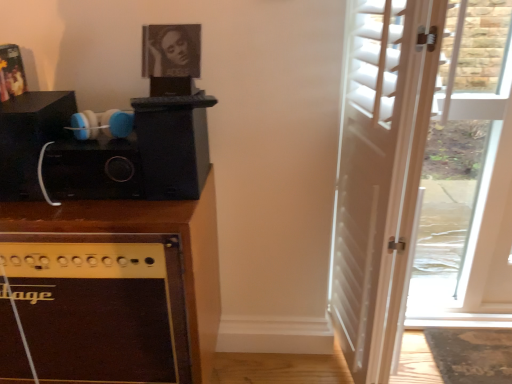
Question: Is matte black picture frame at upper center placed right next to brown wood cabinet at left?

Choices:
 (A) no
 (B) yes

Answer: (A)

Question: From the image's perspective, is matte black picture frame at upper center above brown wood cabinet at left?

Choices:
 (A) yes
 (B) no

Answer: (A)

Question: Is matte black picture frame at upper center oriented towards brown wood cabinet at left?

Choices:
 (A) no
 (B) yes

Answer: (A)

Question: Does matte black picture frame at upper center have a smaller size compared to brown wood cabinet at left?

Choices:
 (A) no
 (B) yes

Answer: (B)

Question: Is matte black picture frame at upper center not inside brown wood cabinet at left?

Choices:
 (A) no
 (B) yes

Answer: (B)

Question: From a real-world perspective, does matte black picture frame at upper center sit lower than brown wood cabinet at left?

Choices:
 (A) yes
 (B) no

Answer: (B)

Question: Does brown wood cabinet at left touch matte black picture frame at upper center?

Choices:
 (A) yes
 (B) no

Answer: (B)

Question: Would you say brown wood cabinet at left is outside matte black picture frame at upper center?

Choices:
 (A) yes
 (B) no

Answer: (A)

Question: Is brown wood cabinet at left behind matte black picture frame at upper center?

Choices:
 (A) yes
 (B) no

Answer: (B)

Question: Does brown wood cabinet at left appear on the right side of matte black picture frame at upper center?

Choices:
 (A) no
 (B) yes

Answer: (A)

Question: From the image's perspective, is brown wood cabinet at left above matte black picture frame at upper center?

Choices:
 (A) yes
 (B) no

Answer: (B)

Question: From the image's perspective, is brown wood cabinet at left under matte black picture frame at upper center?

Choices:
 (A) no
 (B) yes

Answer: (B)

Question: Considering the relative positions of white wood door at right and brown wood cabinet at left in the image provided, is white wood door at right to the right of brown wood cabinet at left from the viewer's perspective?

Choices:
 (A) no
 (B) yes

Answer: (B)